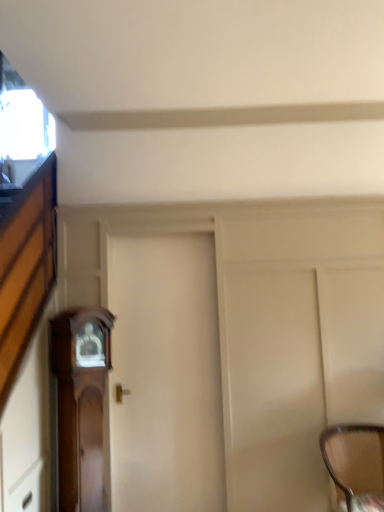
Question: Is white matte door at center outside woven fabric chair at lower right?

Choices:
 (A) no
 (B) yes

Answer: (B)

Question: Considering the relative positions of white matte door at center and woven fabric chair at lower right in the image provided, is white matte door at center behind woven fabric chair at lower right?

Choices:
 (A) no
 (B) yes

Answer: (B)

Question: From the image's perspective, is white matte door at center on top of woven fabric chair at lower right?

Choices:
 (A) no
 (B) yes

Answer: (B)

Question: From a real-world perspective, is white matte door at center located beneath woven fabric chair at lower right?

Choices:
 (A) no
 (B) yes

Answer: (A)

Question: Are white matte door at center and woven fabric chair at lower right making contact?

Choices:
 (A) yes
 (B) no

Answer: (B)

Question: From a real-world perspective, is white matte door at center positioned above or below wooden drawer at lower left?

Choices:
 (A) below
 (B) above

Answer: (B)

Question: Visually, is white matte door at center positioned to the left or to the right of wooden drawer at lower left?

Choices:
 (A) left
 (B) right

Answer: (B)

Question: Is white matte door at center inside or outside of wooden drawer at lower left?

Choices:
 (A) outside
 (B) inside

Answer: (A)

Question: Considering their positions, is white matte door at center located in front of or behind wooden drawer at lower left?

Choices:
 (A) behind
 (B) front

Answer: (A)

Question: Considering their positions, is wooden drawer at lower left located in front of or behind wooden grandfather clock at left?

Choices:
 (A) behind
 (B) front

Answer: (B)

Question: Does point (41, 501) appear closer or farther from the camera than point (104, 380)?

Choices:
 (A) farther
 (B) closer

Answer: (B)

Question: From a real-world perspective, relative to wooden grandfather clock at left, is wooden drawer at lower left vertically above or below?

Choices:
 (A) above
 (B) below

Answer: (B)

Question: Would you say wooden drawer at lower left is to the left or to the right of wooden grandfather clock at left in the picture?

Choices:
 (A) left
 (B) right

Answer: (A)

Question: Do you think white matte door at center is within wooden grandfather clock at left, or outside of it?

Choices:
 (A) outside
 (B) inside

Answer: (A)

Question: Considering the positions of white matte door at center and wooden grandfather clock at left in the image, is white matte door at center taller or shorter than wooden grandfather clock at left?

Choices:
 (A) short
 (B) tall

Answer: (B)